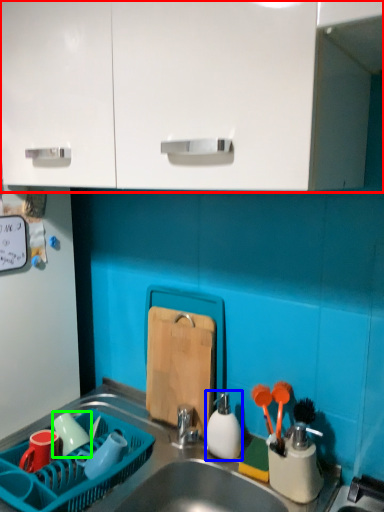
Question: Estimate the real-world distances between objects in this image. Which object is farther from cabinetry (highlighted by a red box), tableware (highlighted by a blue box) or tableware (highlighted by a green box)?

Choices:
 (A) tableware
 (B) tableware

Answer: (B)